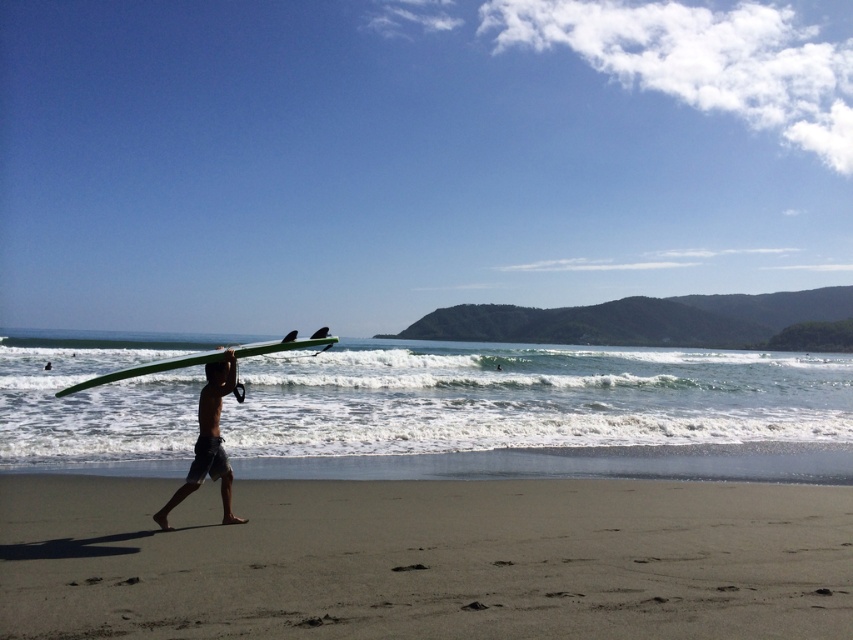
In the scene shown: Between green matte surfboard at center and matte black surfboard at center, which one has more height?

matte black surfboard at center is taller.

Is point (143, 372) behind point (233, 360)?

Yes, point (143, 372) is behind point (233, 360).

Where is `green matte surfboard at center`? green matte surfboard at center is located at coordinates (148, 369).

Between shiny green surfboard at center and green matte surfboard at center, which one appears on the left side from the viewer's perspective?

green matte surfboard at center

Does shiny green surfboard at center have a lesser height compared to green matte surfboard at center?

No, shiny green surfboard at center is not shorter than green matte surfboard at center.

Which is in front, point (207, 433) or point (299, 344)?

Point (207, 433) is more forward.

Where is `shiny green surfboard at center`? shiny green surfboard at center is located at coordinates (207, 442).

Where is `smooth golden sand at lower center`? smooth golden sand at lower center is located at coordinates (426, 560).

Is point (401, 522) closer to viewer compared to point (213, 380)?

No, it is not.

Which is behind, point (788, 534) or point (206, 392)?

The point (788, 534) is more distant.

The width and height of the screenshot is (853, 640). Find the location of `smooth golden sand at lower center`. smooth golden sand at lower center is located at coordinates (426, 560).